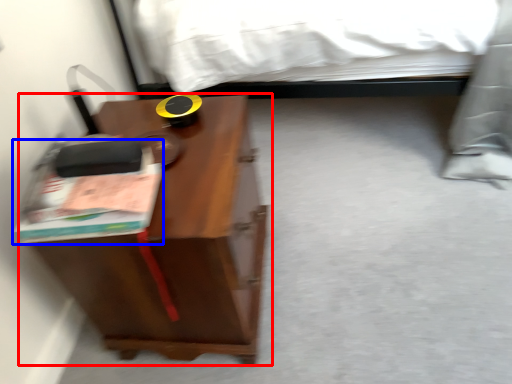
Question: Which object appears closest to the camera in this image, nightstand (highlighted by a red box) or paperback book (highlighted by a blue box)?

Choices:
 (A) nightstand
 (B) paperback book

Answer: (B)